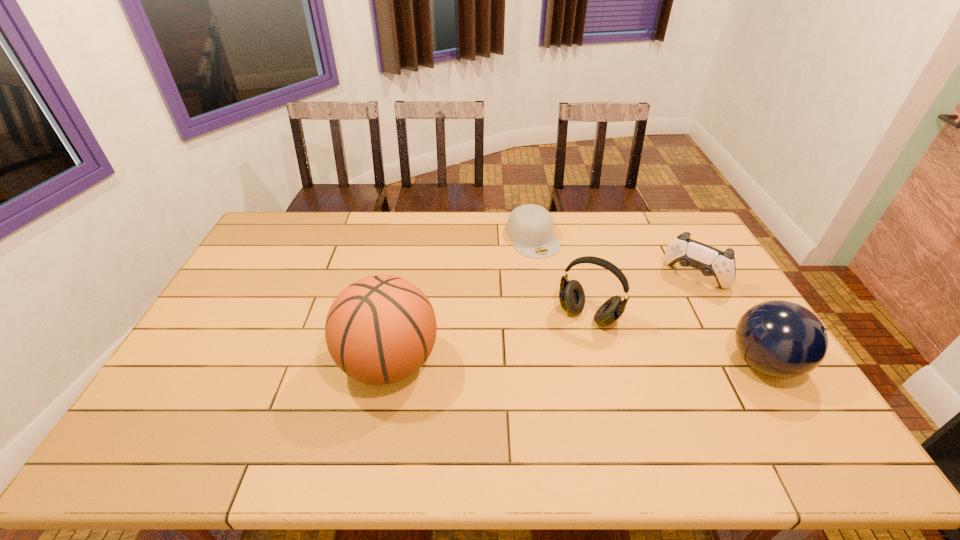
The height and width of the screenshot is (540, 960). I want to click on object that can be found as the fourth closest to the basketball, so click(781, 339).

Find the location of `vacant area in the image that satisfies the following two spatial constraints: 1. on the front side of the headset; 2. on the surface of the bowling ball near the finger holes`. vacant area in the image that satisfies the following two spatial constraints: 1. on the front side of the headset; 2. on the surface of the bowling ball near the finger holes is located at coordinates (601, 363).

This screenshot has height=540, width=960. In order to click on vacant position in the image that satisfies the following two spatial constraints: 1. on the back side of the basketball; 2. on the left side of the farthest object in this screenshot , I will do `click(413, 238)`.

At what (x,y) coordinates should I click in order to perform the action: click on vacant area that satisfies the following two spatial constraints: 1. on the back side of the tallest object; 2. on the left side of the headset. Please return your answer as a coordinate pair (x, y). Looking at the image, I should click on (398, 315).

The image size is (960, 540). Find the location of `vacant space that satisfies the following two spatial constraints: 1. on the back side of the headset; 2. on the left side of the control`. vacant space that satisfies the following two spatial constraints: 1. on the back side of the headset; 2. on the left side of the control is located at coordinates (579, 277).

Locate an element on the screen. The width and height of the screenshot is (960, 540). vacant space that satisfies the following two spatial constraints: 1. on the front side of the headset; 2. on the right side of the shortest object is located at coordinates (545, 315).

Locate an element on the screen. The width and height of the screenshot is (960, 540). free location that satisfies the following two spatial constraints: 1. on the front side of the bowling ball; 2. on the surface of the cap near the finger holes is located at coordinates (552, 363).